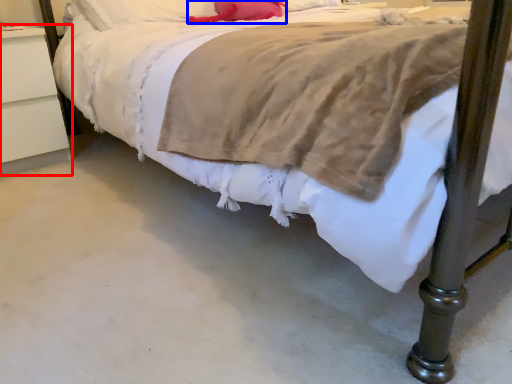
Question: Which object is closer to the camera taking this photo, nightstand (highlighted by a red box) or pillow (highlighted by a blue box)?

Choices:
 (A) nightstand
 (B) pillow

Answer: (A)